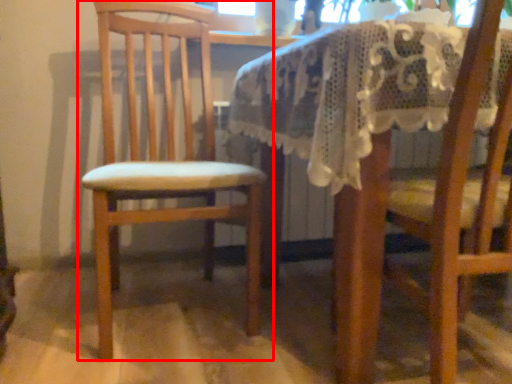
Question: From the image's perspective, where is chair (annotated by the red box) located in relation to chair in the image?

Choices:
 (A) above
 (B) below

Answer: (A)